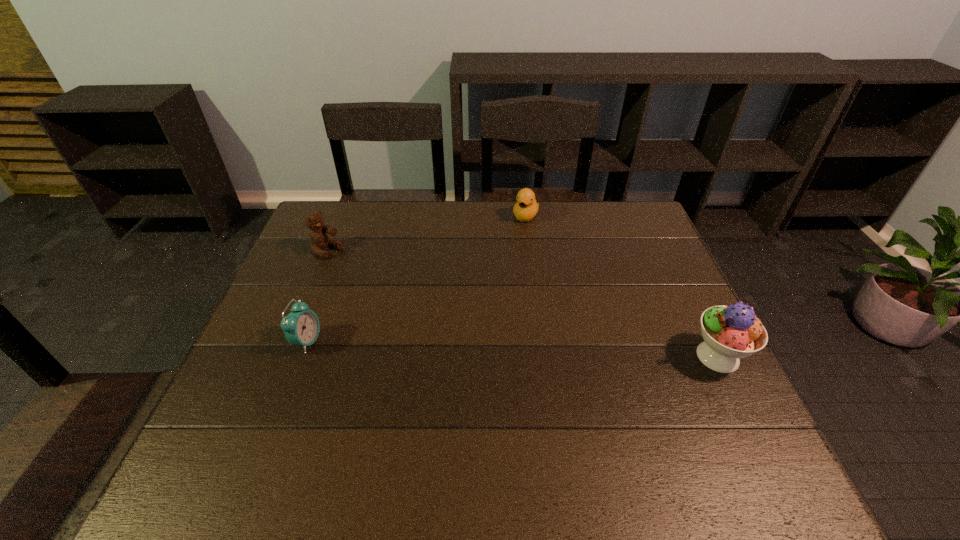
Find the location of a particular element. free point between the third object from left to right and the alarm clock is located at coordinates (417, 279).

Locate an element on the screen. The width and height of the screenshot is (960, 540). unoccupied area between the alarm clock and the tallest object is located at coordinates (513, 349).

Locate an element on the screen. unoccupied area between the duckling and the alarm clock is located at coordinates (417, 279).

The height and width of the screenshot is (540, 960). I want to click on unoccupied position between the alarm clock and the rightmost object, so click(513, 349).

Locate an element on the screen. The width and height of the screenshot is (960, 540). empty location between the icecream and the alarm clock is located at coordinates (513, 349).

Find the location of a particular element. The width and height of the screenshot is (960, 540). vacant point located between the alarm clock and the teddy bear is located at coordinates (317, 296).

You are a GUI agent. You are given a task and a screenshot of the screen. Output one action in this format:
    pyautogui.click(x=<x>, y=<y>)
    Task: Click on the vacant region between the teddy bear and the alarm clock
    
    Given the screenshot: What is the action you would take?
    pyautogui.click(x=317, y=296)

Find the location of `object that stands as the third closest to the second object from right to left`. object that stands as the third closest to the second object from right to left is located at coordinates 301,327.

Identify which object is the closest to the second object from right to left. Please provide its 2D coordinates. Your answer should be formatted as a tuple, i.e. [(x, y)], where the tuple contains the x and y coordinates of a point satisfying the conditions above.

[(319, 239)]

Find the location of a particular element. Image resolution: width=960 pixels, height=540 pixels. vacant space that satisfies the following two spatial constraints: 1. on the front side of the alarm clock; 2. on the face of the teddy bear is located at coordinates (x=291, y=342).